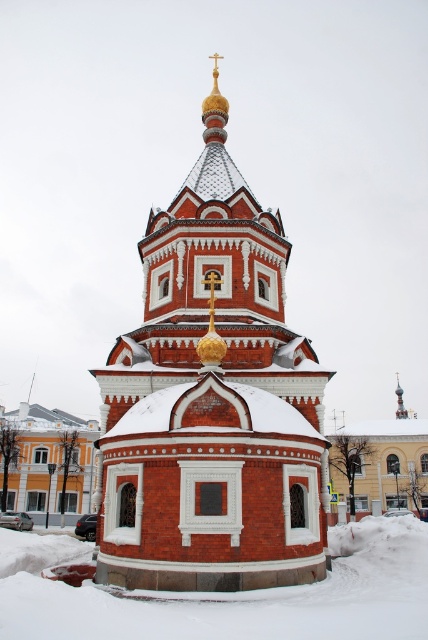
You are a delivery drone with a wingspan of 1.5 meters. You need to fly from the red brick church steeple at center to the white powdery snow at lower center. Is there enough space between them for your drone to pass through safely?

The distance between the red brick church steeple at center and the white powdery snow at lower center is 15.38 meters, which is more than sufficient for a drone with a 1.5 meter wingspan to pass through safely.

You are a photographer planning to take a wide shot of the red brick church steeple at center and the white powdery snow at lower center. Based on their sizes, which object should you focus on to ensure both are clearly visible in the frame?

The red brick church steeple at center is larger in size than the white powdery snow at lower center, so focusing on the steeple will ensure both are clearly visible as it occupies more space in the frame.

You are an architect analyzing the proportions of the red brick church steeple at center and the white powdery snow at lower center in the image. Which object has a smaller width?

The red brick church steeple at center is thinner than the white powdery snow at lower center, so the red brick church steeple at center has a smaller width.